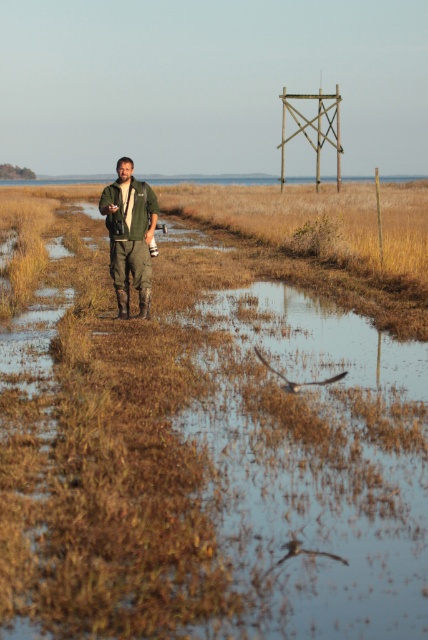
Question: Is brown grassy wetland at center to the left of green matte jacket at center from the viewer's perspective?

Choices:
 (A) yes
 (B) no

Answer: (B)

Question: Which point appears closest to the camera in this image?

Choices:
 (A) (125, 186)
 (B) (59, 362)

Answer: (B)

Question: Is brown grassy wetland at center further to camera compared to green matte jacket at center?

Choices:
 (A) no
 (B) yes

Answer: (A)

Question: Which point is farther to the camera?

Choices:
 (A) green matte jacket at center
 (B) brown grassy wetland at center

Answer: (A)

Question: Can you confirm if brown grassy wetland at center is positioned to the right of green matte jacket at center?

Choices:
 (A) no
 (B) yes

Answer: (B)

Question: Which point is farther from the camera taking this photo?

Choices:
 (A) (139, 285)
 (B) (169, 536)

Answer: (A)